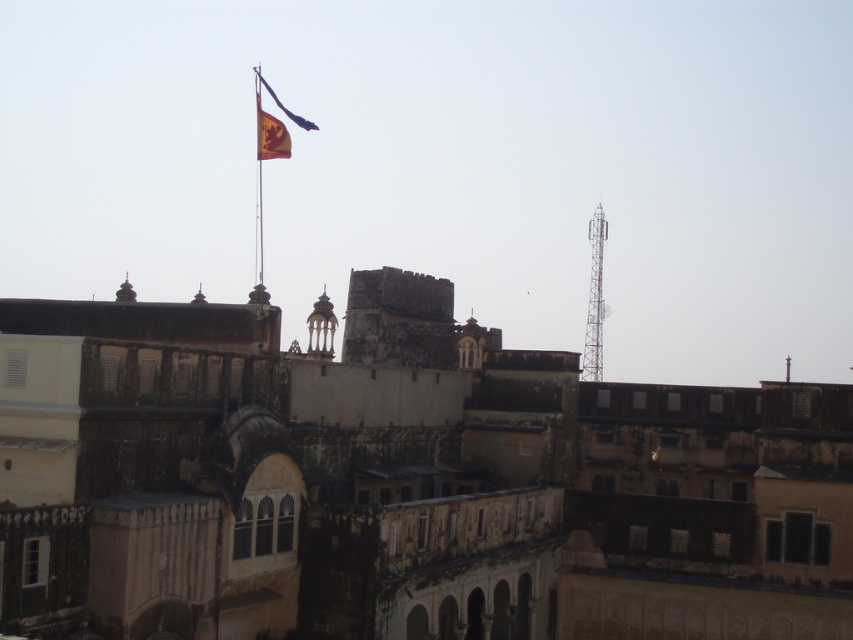
In the scene shown: You are standing at the entrance of the historical building complex and see the point marked at coordinates (x=270, y=134). What object does this point correspond to?

The point at coordinates (x=270, y=134) corresponds to the red fabric flag at upper center.

You are a visitor standing at the entrance of the historical building complex. You notice the red fabric flag at upper center and the metallic flag pole at upper center. From your perspective, which object is positioned to the right side?

The red fabric flag at upper center is positioned to the right of the metallic flag pole at upper center.

You are a photographer planning to capture the historical building complex. You want to ensure both the metallic tower at right and the yellow fabric flag at upper center are clearly visible in your shot. Given their heights, which object might require you to adjust your camera angle to include fully in the frame?

The metallic tower at right is taller than the yellow fabric flag at upper center, so you might need to adjust your camera angle to include the entire metallic tower at right in the frame.